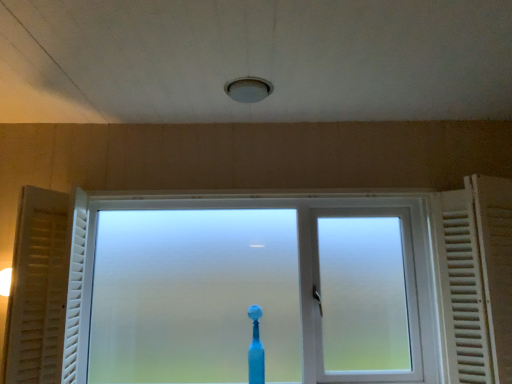
Find the location of a particular element. This screenshot has width=512, height=384. frosted glass window at center is located at coordinates (272, 206).

What do you see at coordinates (272, 206) in the screenshot?
I see `frosted glass window at center` at bounding box center [272, 206].

Where is `white matte curtain at left`? The height and width of the screenshot is (384, 512). white matte curtain at left is located at coordinates (38, 289).

In order to face white matte curtain at left, should I rotate leftwards or rightwards?

You should rotate left by 25.779 degrees.

Where is `blue plastic toothbrush at center`? This screenshot has height=384, width=512. blue plastic toothbrush at center is located at coordinates (256, 349).

Does white matte curtain at left turn towards frosted glass window at center?

No, white matte curtain at left does not turn towards frosted glass window at center.

Considering the positions of objects white matte curtain at left and frosted glass window at center in the image provided, who is more to the right, white matte curtain at left or frosted glass window at center?

Positioned to the right is frosted glass window at center.

How many degrees apart are the facing directions of white matte curtain at left and frosted glass window at center?

There is a 0.942-degree angle between the facing directions of white matte curtain at left and frosted glass window at center.

Does white matte curtain at left have a greater width compared to white wooden radiator at right?

No.

Looking at this image, from a real-world perspective, is white matte curtain at left located beneath white wooden radiator at right?

No, from a real-world perspective, white matte curtain at left is not under white wooden radiator at right.

From the image's perspective, is white matte curtain at left beneath white wooden radiator at right?

Correct, white matte curtain at left appears lower than white wooden radiator at right in the image.

Can you tell me how much white matte curtain at left and white wooden radiator at right differ in facing direction?

3.19 degrees.

In terms of height, does white wooden radiator at right look taller or shorter compared to white matte curtain at left?

white wooden radiator at right is taller than white matte curtain at left.

Between white wooden radiator at right and white matte curtain at left, which one has larger size?

Bigger between the two is white wooden radiator at right.

Is white wooden radiator at right facing away from white matte curtain at left?

No.

Which object is further away from the camera, white matte curtain at left or blue plastic toothbrush at center?

blue plastic toothbrush at center is more distant.

The image size is (512, 384). What are the coordinates of `curtain above the blue plastic toothbrush at center (from a real-world perspective)` in the screenshot? It's located at (38, 289).

Can you confirm if white matte curtain at left is wider than blue plastic toothbrush at center?

Correct, the width of white matte curtain at left exceeds that of blue plastic toothbrush at center.

Considering the points (51, 383) and (253, 309), which point is in front, point (51, 383) or point (253, 309)?

The point (51, 383) is in front.

Does white wooden radiator at right have a lesser height compared to frosted glass window at center?

Correct, white wooden radiator at right is not as tall as frosted glass window at center.

This screenshot has width=512, height=384. I want to click on window on the left of white wooden radiator at right, so click(272, 206).

Looking at their sizes, would you say white wooden radiator at right is wider or thinner than frosted glass window at center?

In the image, white wooden radiator at right appears to be wider than frosted glass window at center.

From the image's perspective, relative to blue plastic toothbrush at center, is white wooden radiator at right above or below?

Based on their image positions, white wooden radiator at right is located above blue plastic toothbrush at center.

Does white wooden radiator at right have a lesser width compared to blue plastic toothbrush at center?

Incorrect, the width of white wooden radiator at right is not less than that of blue plastic toothbrush at center.

Which of these two, white wooden radiator at right or blue plastic toothbrush at center, stands taller?

Standing taller between the two is white wooden radiator at right.

Considering the positions of objects white wooden radiator at right and blue plastic toothbrush at center in the image provided, who is in front, white wooden radiator at right or blue plastic toothbrush at center?

white wooden radiator at right is in front.

Where is `window in front of the blue plastic toothbrush at center`? The width and height of the screenshot is (512, 384). window in front of the blue plastic toothbrush at center is located at coordinates (272, 206).

Who is shorter, frosted glass window at center or blue plastic toothbrush at center?

blue plastic toothbrush at center.

Is frosted glass window at center with blue plastic toothbrush at center?

frosted glass window at center is not next to blue plastic toothbrush at center, and they're not touching.

Is frosted glass window at center in front of blue plastic toothbrush at center?

Yes, frosted glass window at center is in front of blue plastic toothbrush at center.

This screenshot has width=512, height=384. Find the location of `window behind the white matte curtain at left`. window behind the white matte curtain at left is located at coordinates (272, 206).

Locate an element on the screen. curtain that appears on the left of white wooden radiator at right is located at coordinates (38, 289).

Which object lies nearer to the anchor point white matte curtain at left, white wooden radiator at right or frosted glass window at center?

frosted glass window at center is closer to white matte curtain at left.

Which object lies further to the anchor point frosted glass window at center, white matte curtain at left or white wooden radiator at right?

The object further to frosted glass window at center is white matte curtain at left.

From the image, which object appears to be farther from frosted glass window at center, white wooden radiator at right or blue plastic toothbrush at center?

The object further to frosted glass window at center is blue plastic toothbrush at center.

Based on their spatial positions, is white matte curtain at left or blue plastic toothbrush at center further from white wooden radiator at right?

Among the two, white matte curtain at left is located further to white wooden radiator at right.

From the image, which object appears to be farther from blue plastic toothbrush at center, frosted glass window at center or white wooden radiator at right?

Based on the image, white wooden radiator at right appears to be further to blue plastic toothbrush at center.

Based on their spatial positions, is white matte curtain at left or frosted glass window at center closer to white wooden radiator at right?

The object closer to white wooden radiator at right is frosted glass window at center.

Looking at this image, which object lies further to the anchor point white matte curtain at left, blue plastic toothbrush at center or white wooden radiator at right?

Among the two, white wooden radiator at right is located further to white matte curtain at left.

From the image, which object appears to be nearer to white wooden radiator at right, frosted glass window at center or blue plastic toothbrush at center?

frosted glass window at center is closer to white wooden radiator at right.

You are a GUI agent. You are given a task and a screenshot of the screen. Output one action in this format:
    pyautogui.click(x=<x>, y=<y>)
    Task: Click on the toothbrush between frosted glass window at center and white wooden radiator at right from left to right
    
    Given the screenshot: What is the action you would take?
    pyautogui.click(x=256, y=349)

The height and width of the screenshot is (384, 512). I want to click on window between white matte curtain at left and blue plastic toothbrush at center from left to right, so click(272, 206).

This screenshot has height=384, width=512. In order to click on toothbrush located between white matte curtain at left and white wooden radiator at right in the left-right direction in this screenshot , I will do `click(256, 349)`.

Identify the location of window located between white matte curtain at left and white wooden radiator at right in the left-right direction. This screenshot has height=384, width=512. (272, 206).